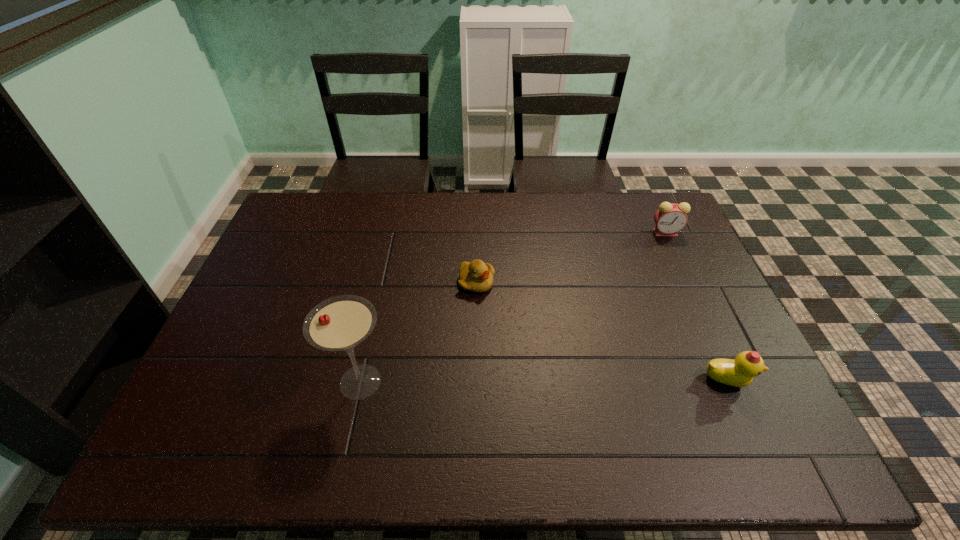
At what (x,y) coordinates should I click in order to perform the action: click on object at the near right corner. Please return your answer as a coordinate pair (x, y). The height and width of the screenshot is (540, 960). Looking at the image, I should click on (740, 372).

Where is `vacant space at the far edge of the desktop`? vacant space at the far edge of the desktop is located at coordinates (468, 210).

In the image, there is a desktop. At what (x,y) coordinates should I click in order to perform the action: click on vacant space at the near edge. Please return your answer as a coordinate pair (x, y). Looking at the image, I should click on (411, 406).

In the image, there is a desktop. Where is `free region at the left edge`? The width and height of the screenshot is (960, 540). free region at the left edge is located at coordinates (273, 237).

Where is `vacant space at the right edge of the desktop`? This screenshot has width=960, height=540. vacant space at the right edge of the desktop is located at coordinates (716, 328).

You are a GUI agent. You are given a task and a screenshot of the screen. Output one action in this format:
    pyautogui.click(x=<x>, y=<y>)
    Task: Click on the free space at the far left corner of the desktop
    Image resolution: width=960 pixels, height=540 pixels.
    Given the screenshot: What is the action you would take?
    pyautogui.click(x=294, y=230)

The width and height of the screenshot is (960, 540). In order to click on empty space between the farther duckling and the farthest object in this screenshot , I will do `click(571, 257)`.

Find the location of a particular element. The image size is (960, 540). vacant area between the farthest object and the leftmost object is located at coordinates (513, 307).

The height and width of the screenshot is (540, 960). Find the location of `unoccupied position between the alarm clock and the second object from left to right`. unoccupied position between the alarm clock and the second object from left to right is located at coordinates (571, 257).

Find the location of `blank region between the right duckling and the farthest object`. blank region between the right duckling and the farthest object is located at coordinates [x=696, y=306].